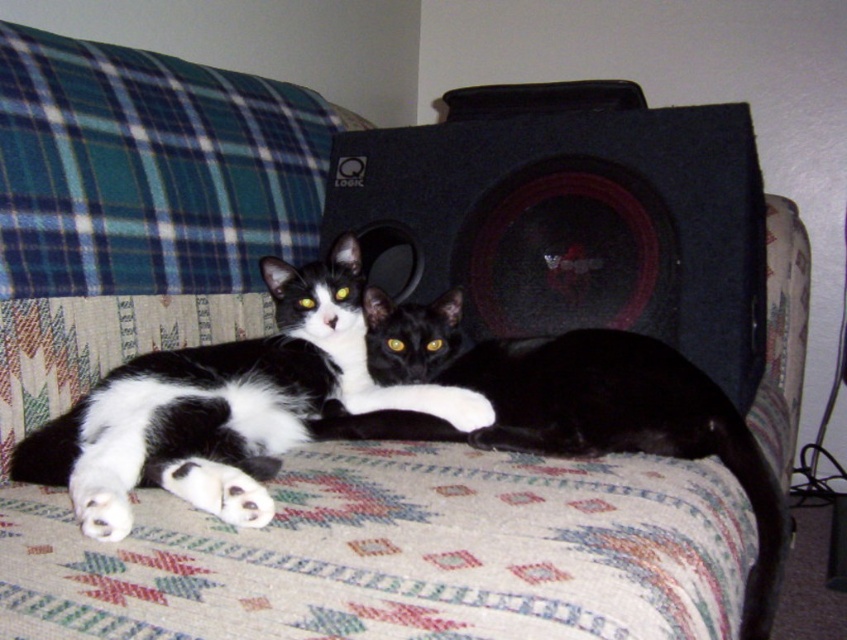
Locate an element on the screen. This screenshot has height=640, width=847. black and white fur cat at center is located at coordinates (227, 406).

Between point (72, 436) and point (596, 429), which one is positioned in front?

Point (72, 436) is more forward.

What are the coordinates of `black and white fur cat at center` in the screenshot? It's located at (227, 406).

Is the position of black matte speaker at center more distant than that of black and white fur cat at center?

Yes, black matte speaker at center is behind black and white fur cat at center.

In the scene shown: How distant is black matte speaker at center from black and white fur cat at center?

black matte speaker at center is 13.77 inches from black and white fur cat at center.

Between point (709, 244) and point (31, 461), which one is positioned in front?

Point (31, 461) is in front.

The width and height of the screenshot is (847, 640). I want to click on black matte speaker at center, so click(x=573, y=225).

Between black matte speaker at center and black glossy cat at center, which one has less height?

black glossy cat at center is shorter.

Between black matte speaker at center and black glossy cat at center, which one is positioned higher?

black matte speaker at center is above.

Measure the distance between point (x=640, y=196) and camera.

Point (x=640, y=196) is 4.22 feet away from camera.

The width and height of the screenshot is (847, 640). I want to click on black matte speaker at center, so click(573, 225).